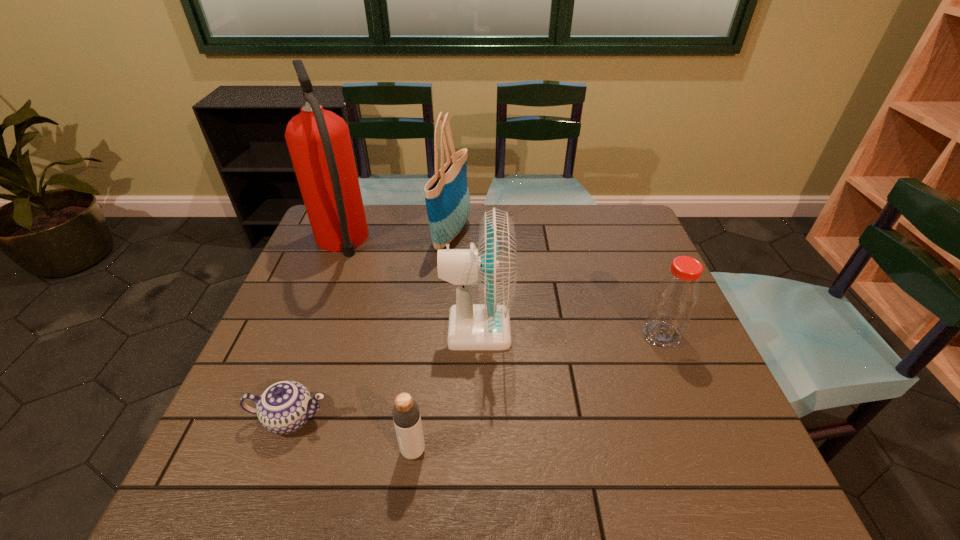
The height and width of the screenshot is (540, 960). In order to click on free space between the chinaware and the fan in this screenshot , I will do `click(384, 374)`.

The height and width of the screenshot is (540, 960). What are the coordinates of `free space between the nearer bottle and the tote bag` in the screenshot? It's located at (432, 341).

Where is `free space between the shortest object and the second shortest object`? The image size is (960, 540). free space between the shortest object and the second shortest object is located at coordinates (352, 434).

At what (x,y) coordinates should I click in order to perform the action: click on vacant area that lies between the right bottle and the second tallest object. Please return your answer as a coordinate pair (x, y). The height and width of the screenshot is (540, 960). Looking at the image, I should click on (557, 284).

The height and width of the screenshot is (540, 960). In order to click on blank region between the shortest object and the second tallest object in this screenshot , I will do `click(372, 326)`.

Select which object appears as the fifth closest to the fire extinguisher. Please provide its 2D coordinates. Your answer should be formatted as a tuple, i.e. [(x, y)], where the tuple contains the x and y coordinates of a point satisfying the conditions above.

[(676, 295)]

This screenshot has height=540, width=960. Identify the location of object that is the second nearest to the nearer bottle. (493, 266).

Where is `vacant region that satisfies the following two spatial constraints: 1. on the front side of the tote bag; 2. at the spout of the chinaware`? vacant region that satisfies the following two spatial constraints: 1. on the front side of the tote bag; 2. at the spout of the chinaware is located at coordinates (437, 418).

Identify the location of vacant space that satisfies the following two spatial constraints: 1. in front of the fan to face the airflow; 2. on the front side of the nearer bottle. (476, 450).

Where is `free space in the image that satisfies the following two spatial constraints: 1. in front of the fan to face the airflow; 2. on the front side of the shorter bottle`? free space in the image that satisfies the following two spatial constraints: 1. in front of the fan to face the airflow; 2. on the front side of the shorter bottle is located at coordinates (476, 450).